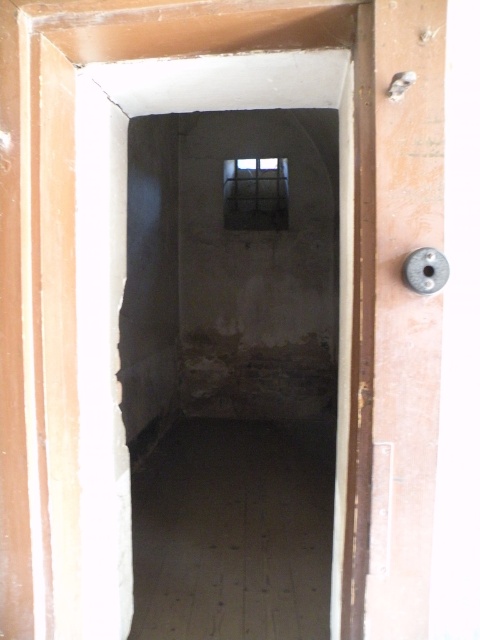
You are standing in front of the wooden door knob at right and want to look through the transparent glass window at center. In which direction should you turn your head to see the window?

The wooden door knob at right is to the right of the transparent glass window at center, so you should turn your head to the left to see the window.

You are standing in front of the doorway and notice the smooth concrete basement at center and the transparent glass window at center. Which object is located to the left of the other?

The smooth concrete basement at center is positioned on the left side of transparent glass window at center.